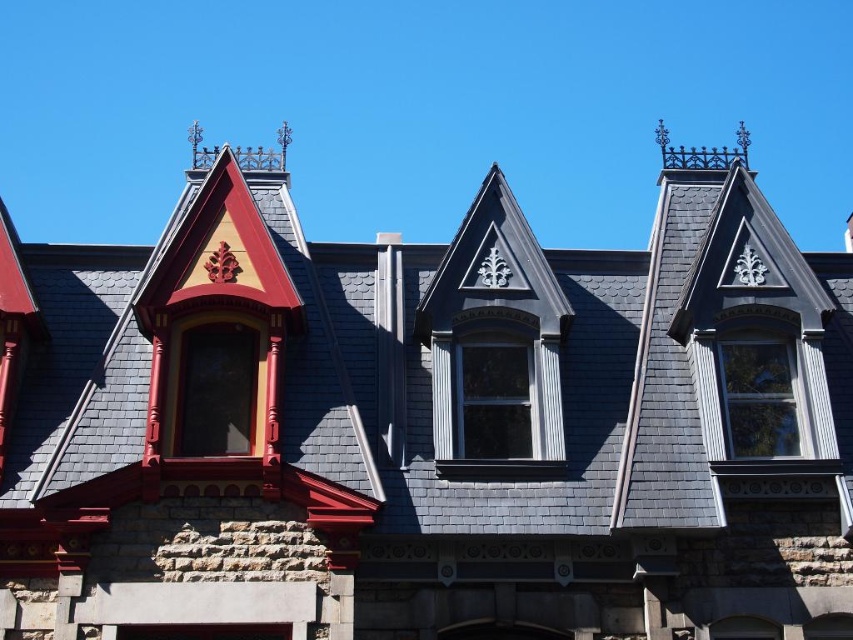
Question: Which point is closer to the camera?

Choices:
 (A) gray slate roof at upper center
 (B) matte gray wood window at center
 (C) smooth gray wood window at center right
 (D) matte red wood window at upper left

Answer: (A)

Question: Is matte red wood window at upper left wider than smooth gray wood window at center right?

Choices:
 (A) no
 (B) yes

Answer: (A)

Question: Which of the following is the closest to the observer?

Choices:
 (A) gray slate roof at upper center
 (B) matte red wood window at upper left

Answer: (A)

Question: Can you confirm if gray slate roof at upper center is positioned above matte red wood window at upper left?

Choices:
 (A) no
 (B) yes

Answer: (B)

Question: Estimate the real-world distances between objects in this image. Which object is farther from the smooth gray wood window at center right?

Choices:
 (A) matte gray wood window at center
 (B) clear glass window at center
 (C) gray slate roof at upper center
 (D) matte red wood window at upper left

Answer: (D)

Question: Is gray slate roof at upper center to the right of smooth gray wood window at center right from the viewer's perspective?

Choices:
 (A) yes
 (B) no

Answer: (A)